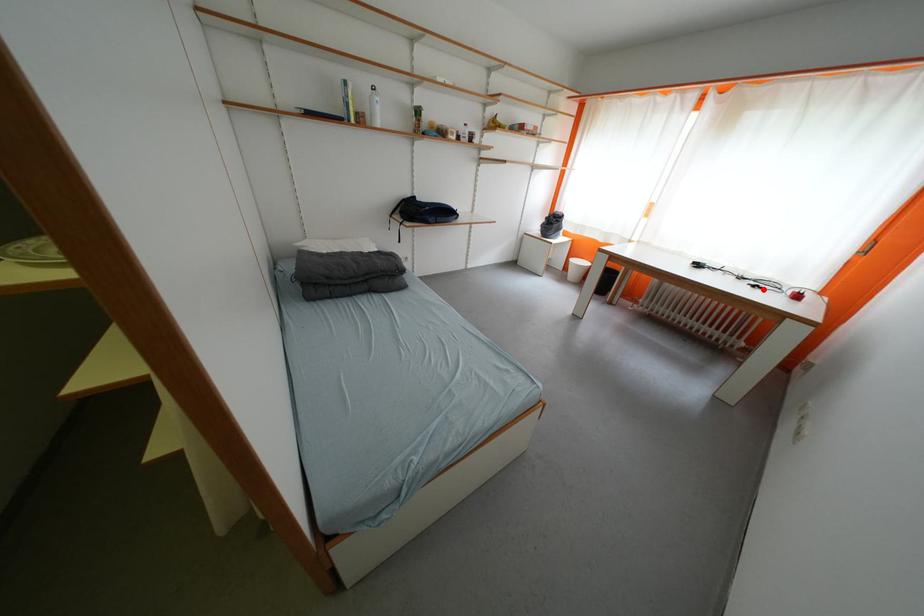
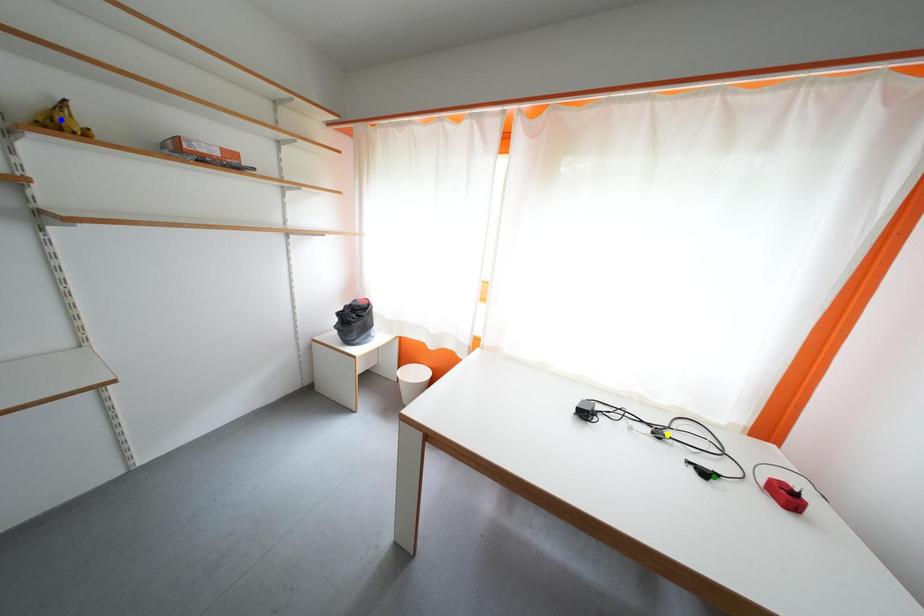
Question: I am providing you with two images of the same scene from different viewpoints. A red point is marked on the first image. You are given multiple points on the second image. Which point in image 2 is actually the same real-world point as the red point in image 1?

Choices:
 (A) yellow point
 (B) green point
 (C) blue point

Answer: (B)